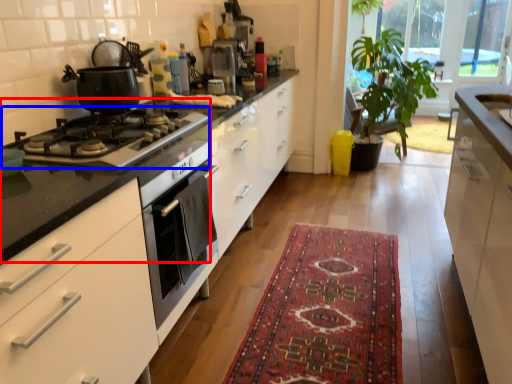
Question: Which object appears farthest to the camera in this image, gas stove (highlighted by a red box) or gas stove (highlighted by a blue box)?

Choices:
 (A) gas stove
 (B) gas stove

Answer: (A)